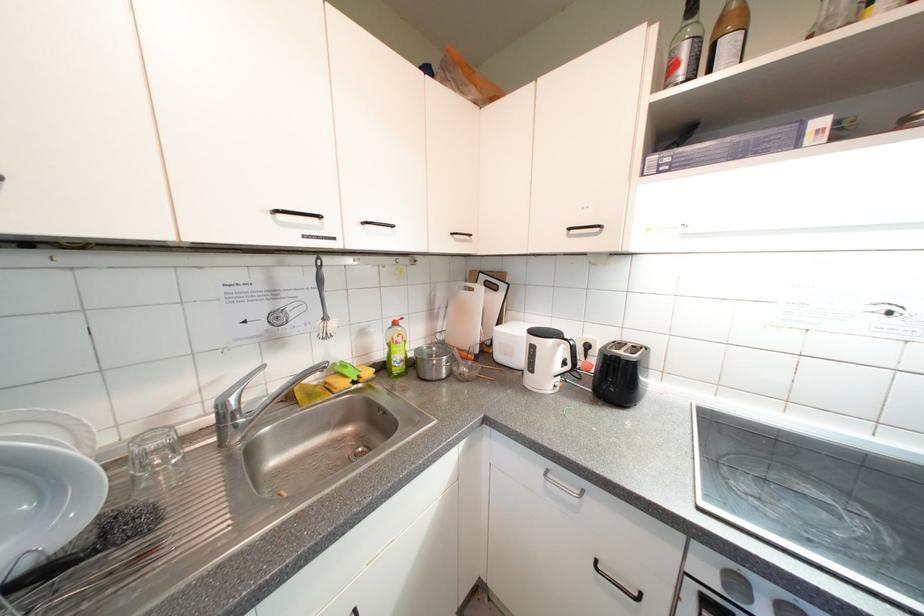
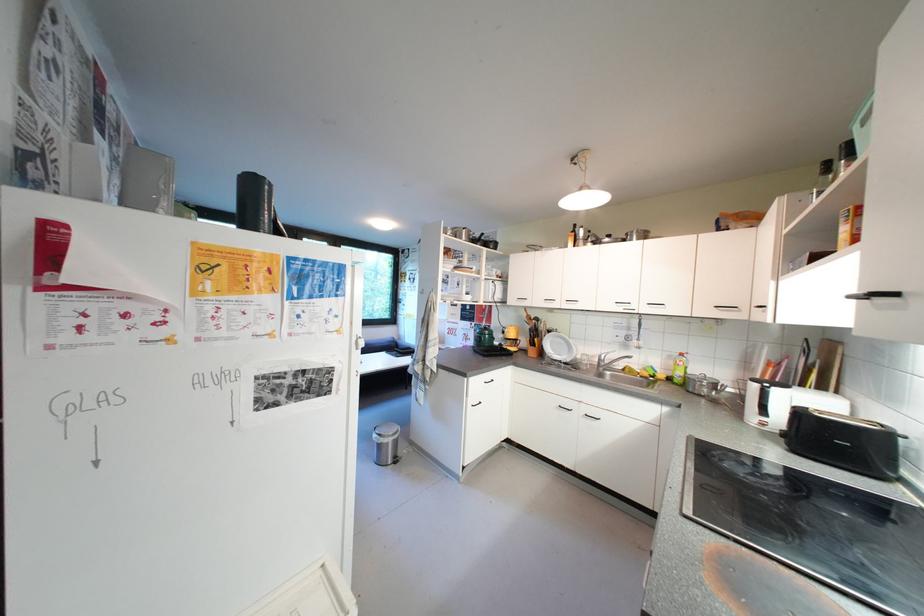
Find the pixel in the second image that matches [178,413] in the first image.

(602, 359)